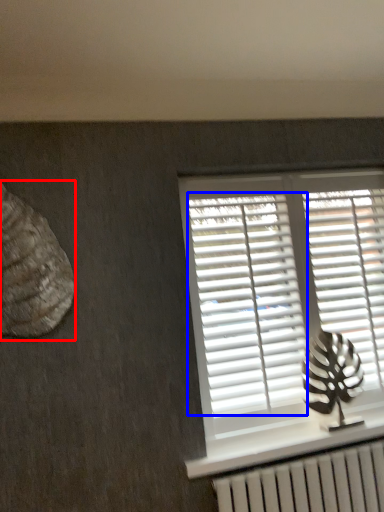
Question: Which object is closer to the camera taking this photo, animal (highlighted by a red box) or shutter (highlighted by a blue box)?

Choices:
 (A) animal
 (B) shutter

Answer: (A)